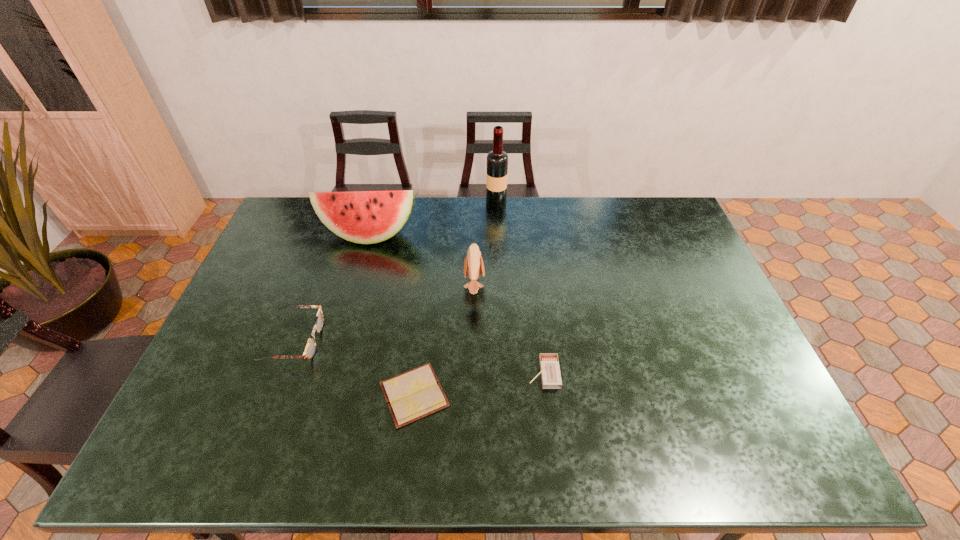
Locate an element on the screen. watermelon that is positioned at the left edge is located at coordinates tap(366, 217).

Where is `spectacles that is at the left edge`? The height and width of the screenshot is (540, 960). spectacles that is at the left edge is located at coordinates (310, 349).

I want to click on object situated at the far left corner, so click(x=366, y=217).

I want to click on vacant space at the far edge of the desktop, so click(546, 204).

In the image, there is a desktop. In order to click on free space at the near edge in this screenshot , I will do `click(304, 454)`.

The image size is (960, 540). I want to click on vacant position at the right edge of the desktop, so click(705, 392).

Locate an element on the screen. free space at the far right corner of the desktop is located at coordinates (657, 207).

Where is `vacant space at the near right corner of the desktop`? vacant space at the near right corner of the desktop is located at coordinates (786, 433).

Identify the location of vacant area between the farthest object and the rightmost object. (520, 289).

You are a GUI agent. You are given a task and a screenshot of the screen. Output one action in this format:
    pyautogui.click(x=<x>, y=<y>)
    Task: Click on the free space between the second tallest object and the rightmost object
    This screenshot has width=960, height=540.
    Given the screenshot: What is the action you would take?
    pyautogui.click(x=456, y=304)